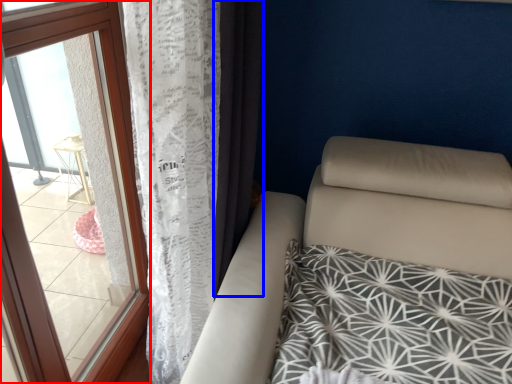
Question: Which of the following is the closest to the observer, window (highlighted by a red box) or curtain (highlighted by a blue box)?

Choices:
 (A) window
 (B) curtain

Answer: (A)